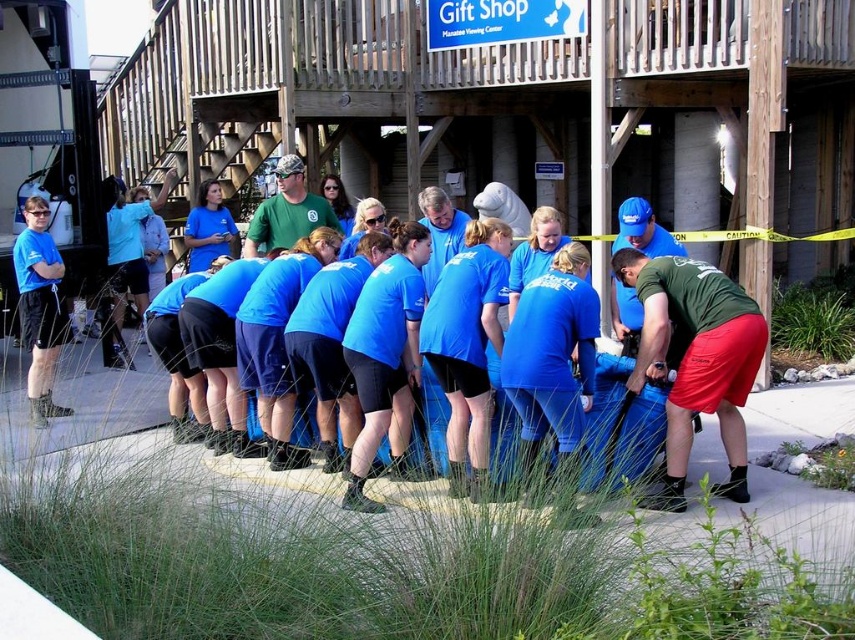
Question: Is green matte shirt at center to the left of matte blue t-shirt at left from the viewer's perspective?

Choices:
 (A) yes
 (B) no

Answer: (B)

Question: Which object is farther from the camera taking this photo?

Choices:
 (A) green matte shirt at center
 (B) matte blue t-shirt at left

Answer: (B)

Question: Among these objects, which one is farthest from the camera?

Choices:
 (A) green matte shirt at center
 (B) matte blue t-shirt at left

Answer: (B)

Question: Is green matte shirt at center smaller than matte blue t-shirt at left?

Choices:
 (A) no
 (B) yes

Answer: (A)

Question: Is green matte shirt at center to the left of matte blue t-shirt at left from the viewer's perspective?

Choices:
 (A) no
 (B) yes

Answer: (A)

Question: Among these objects, which one is farthest from the camera?

Choices:
 (A) green matte shirt at center
 (B) matte blue t-shirt at left

Answer: (B)